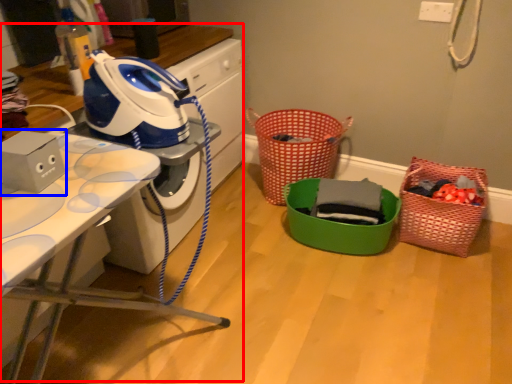
Question: Which of the following is the closest to the observer, computer desk (highlighted by a red box) or appliance (highlighted by a blue box)?

Choices:
 (A) computer desk
 (B) appliance

Answer: (B)